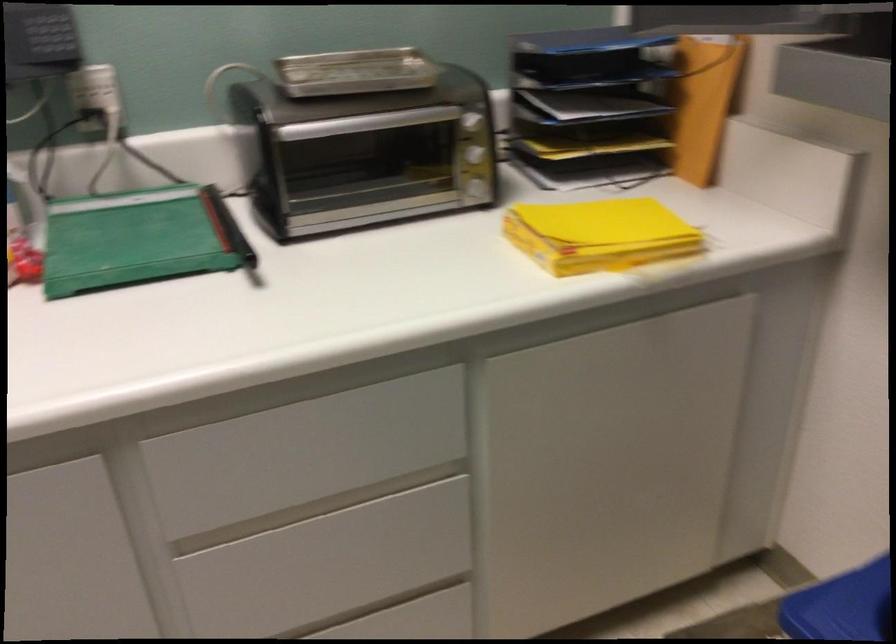
The images are taken continuously from a first-person perspective. In which direction is your viewpoint rotating?

The rotation direction of the camera is left-down.